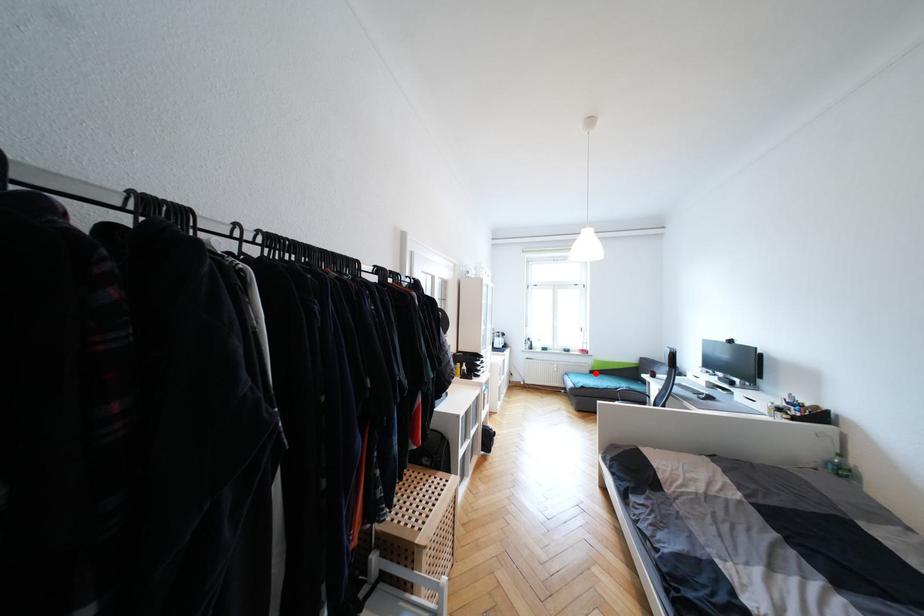
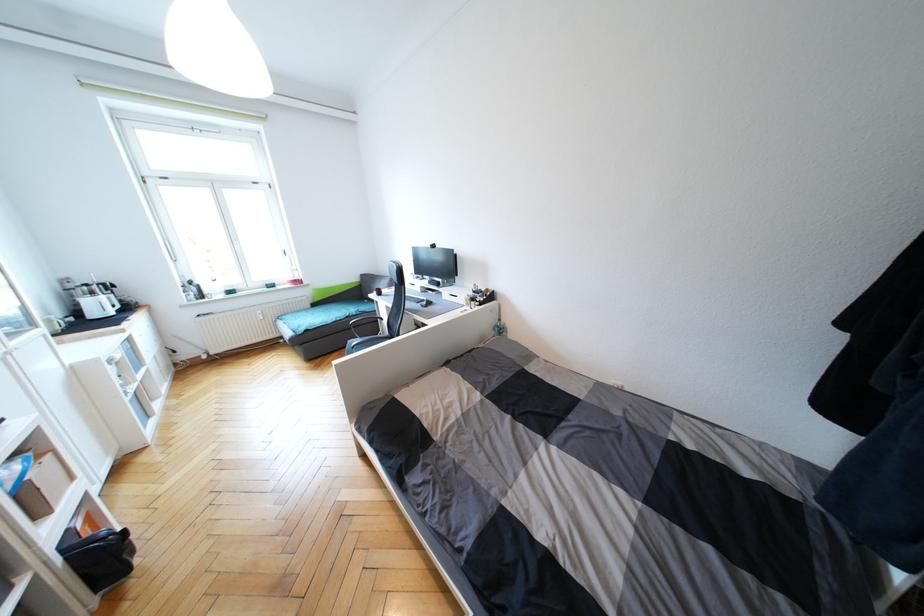
The point at the highlighted location is marked in the first image. Where is the corresponding point in the second image?

(319, 306)